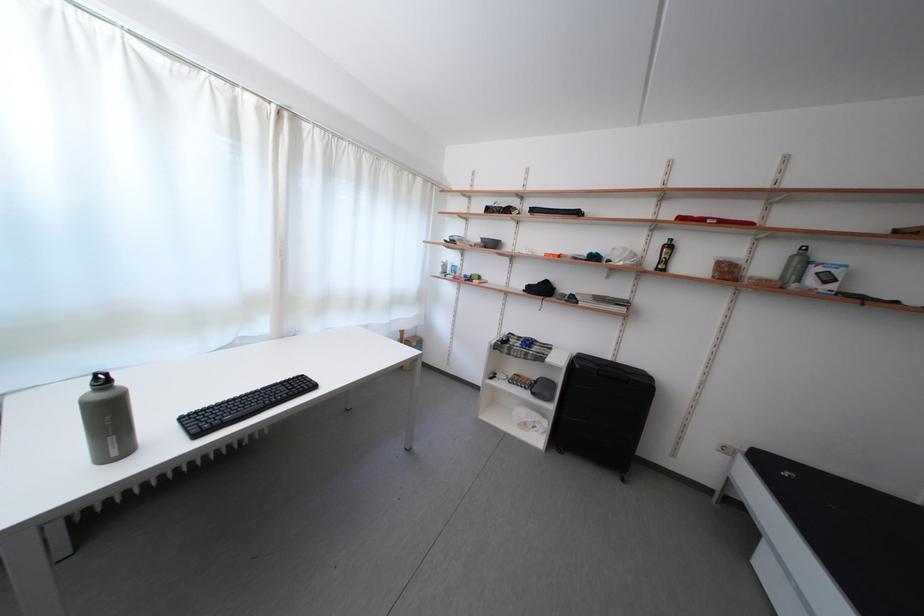
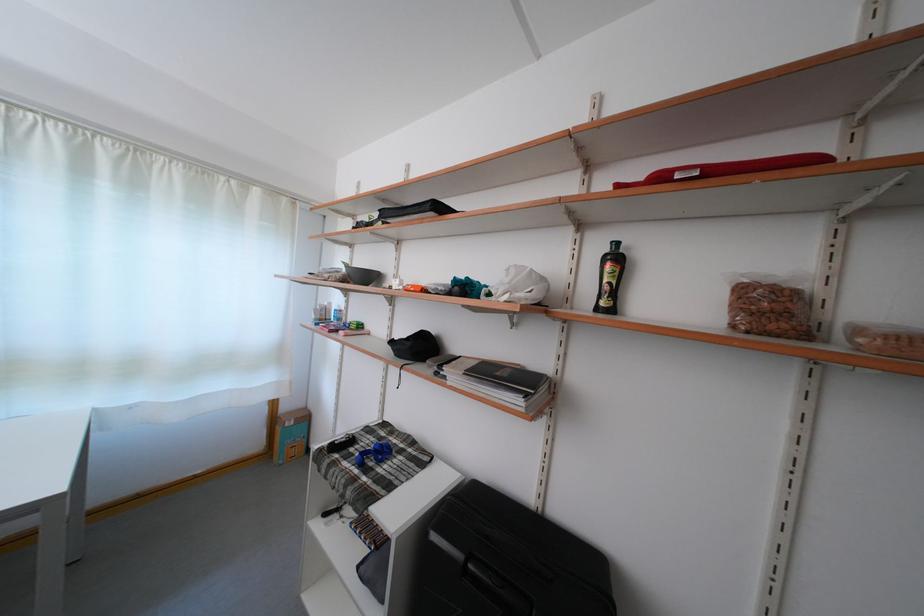
The point at [631,315] is marked in the first image. Where is the corresponding point in the second image?

(527, 408)